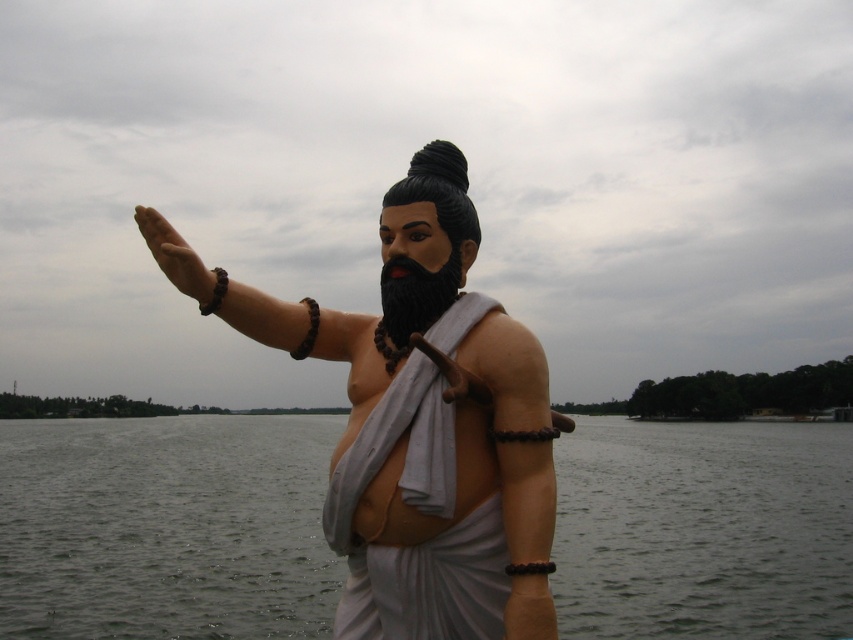
Question: Which point appears farthest from the camera in this image?

Choices:
 (A) (448, 294)
 (B) (576, 440)
 (C) (352, 460)
 (D) (138, 221)

Answer: (B)

Question: Does transparent water at statue right appear under black matte beard at center?

Choices:
 (A) yes
 (B) no

Answer: (A)

Question: Which is nearer to the black matte beard at center?

Choices:
 (A) transparent water at statue right
 (B) matte brown hand at upper center
 (C) matte white statue at center

Answer: (C)

Question: Can you confirm if matte white statue at center is positioned above matte brown hand at upper center?

Choices:
 (A) yes
 (B) no

Answer: (B)

Question: Can you confirm if transparent water at statue right is smaller than black matte beard at center?

Choices:
 (A) yes
 (B) no

Answer: (B)

Question: Which object appears closest to the camera in this image?

Choices:
 (A) transparent water at statue right
 (B) matte white statue at center
 (C) matte brown hand at upper center

Answer: (B)